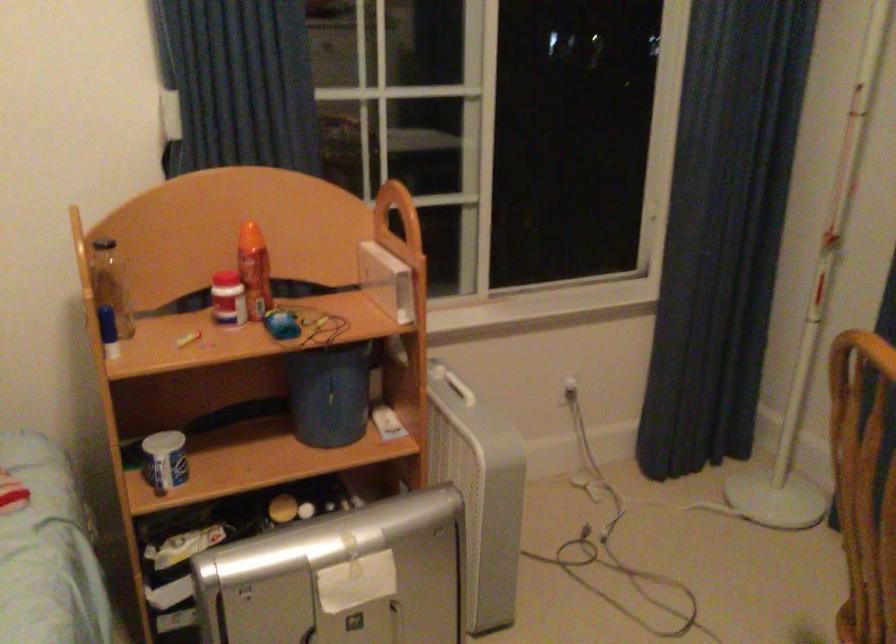
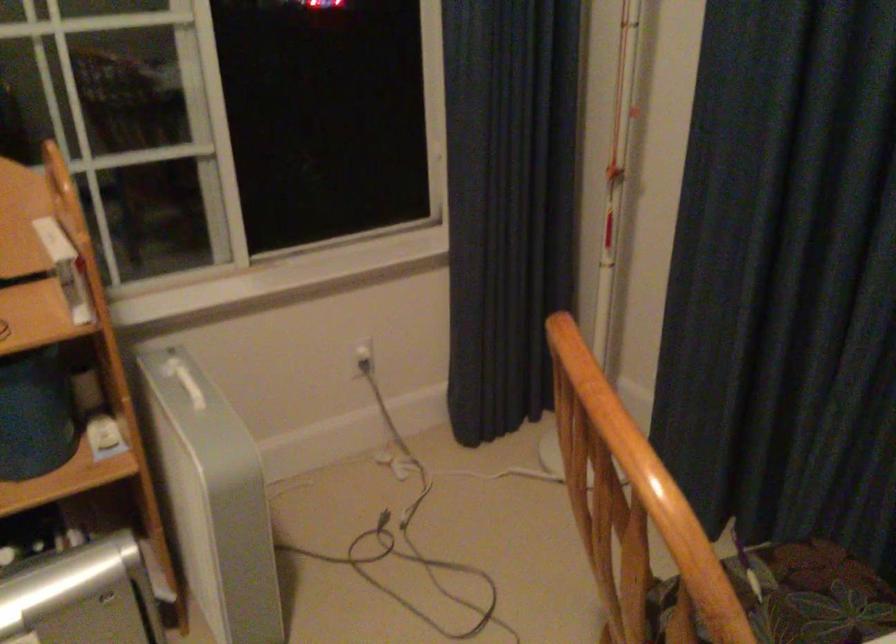
The point at (480, 480) is marked in the first image. Where is the corresponding point in the second image?

(211, 498)